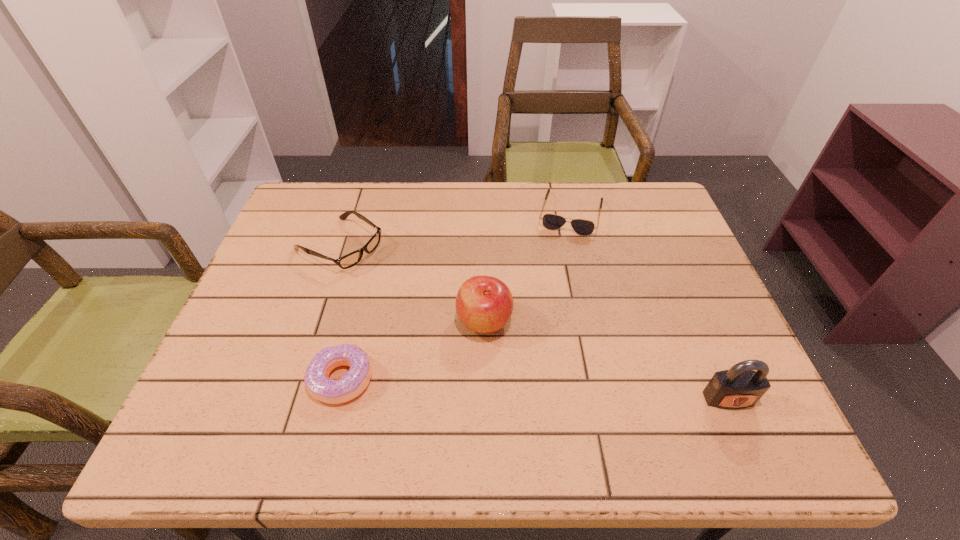
Where is `vacant space on the desktop that is between the doughnut and the rightmost object and is positioned on the stem of the apple`? This screenshot has width=960, height=540. vacant space on the desktop that is between the doughnut and the rightmost object and is positioned on the stem of the apple is located at coordinates (542, 390).

This screenshot has height=540, width=960. What are the coordinates of `vacant space on the desktop that is between the doughnut and the padlock and is positioned on the front-facing side of the sunglasses` in the screenshot? It's located at (530, 389).

Identify the location of free space on the desktop that is between the doughnut and the padlock and is positioned on the front-facing side of the spectacles. Image resolution: width=960 pixels, height=540 pixels. (588, 392).